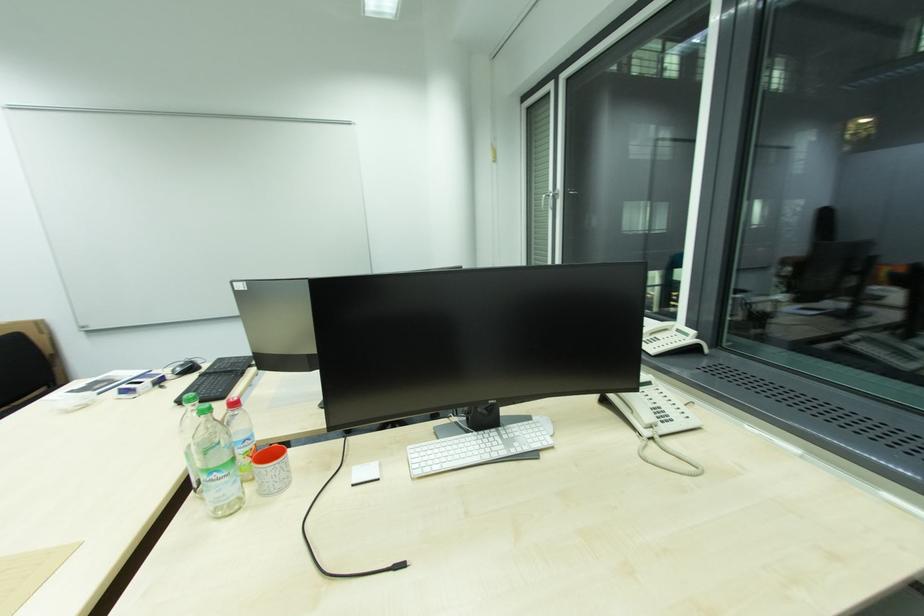
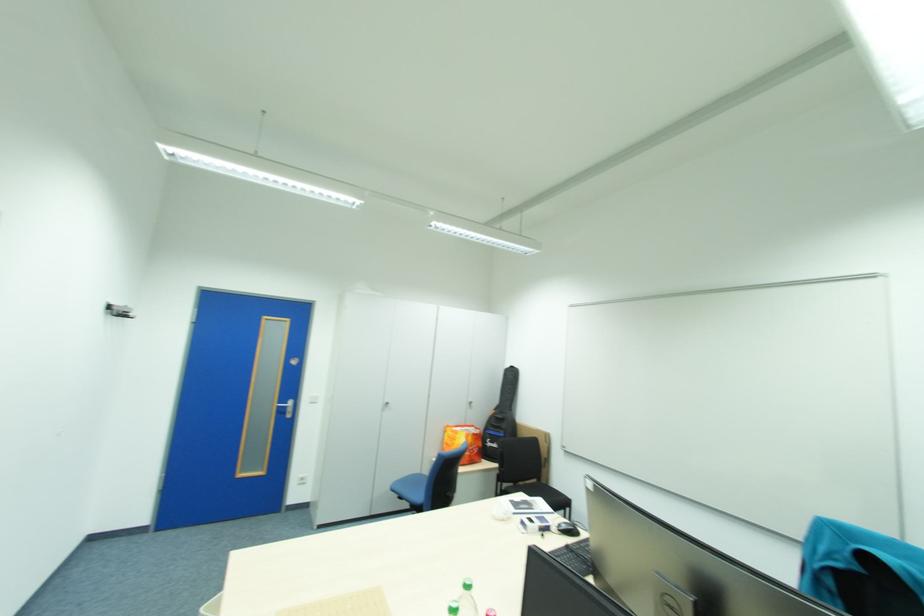
Question: Based on the continuous images, in which direction is the camera rotating? Reply with the corresponding letter.

Choices:
 (A) Left
 (B) Right
 (C) Up
 (D) Down

Answer: (A)